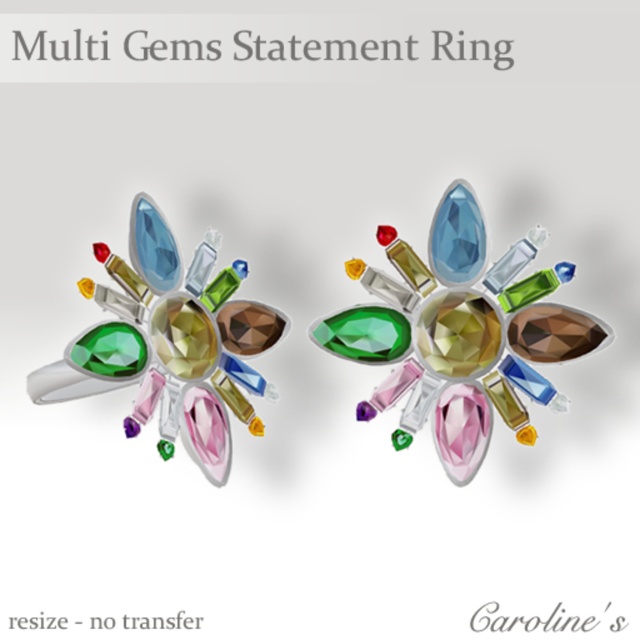
You are a jeweler who needs to photograph a ring. You have a camera that can focus clearly on objects within 3 feet. If you want to take a clear photo of the multicolored gemstone ring at center, should you move closer or farther away from the ring?

The multicolored gemstone ring at center is 3.37 feet away from the camera. Since the camera can focus clearly within 3 feet, you need to move closer to the ring to ensure it is within the 3 feet range for clear focus.

You are an appraiser examining two points on the image of the rings. The first point is at coordinates point (436, 227) and the second is at point (99, 371). Which point is positioned closer to you?

Point (436, 227) is closer to the viewer than point (99, 371).

You are an appraiser examining two rings displayed on a table. The multicolored gemstone ring at center and the matte silver ring at center are both on the table. Which ring is positioned higher up?

The multicolored gemstone ring at center is above the matte silver ring at center, so it is positioned higher up.